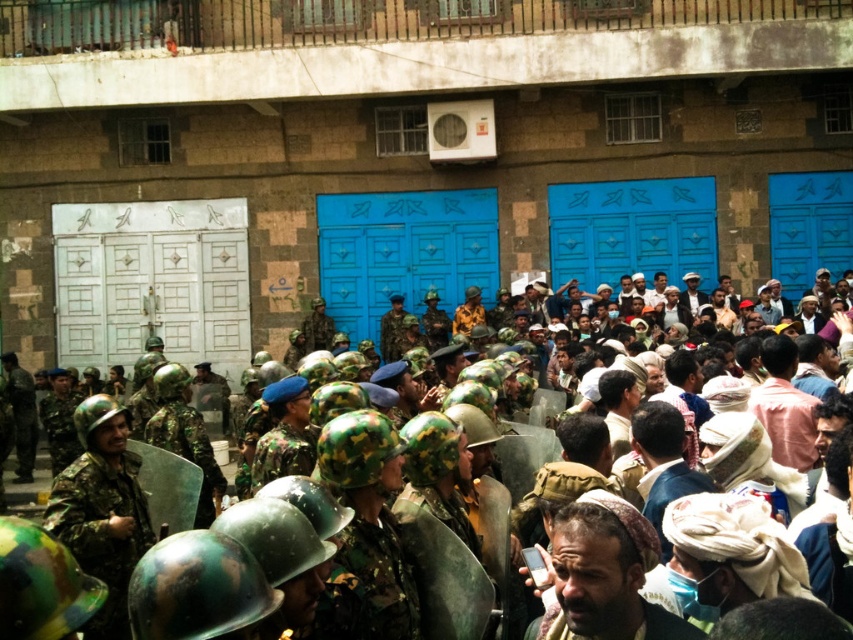
Is point (648, 632) less distant than point (397, 321)?

Yes.

Which of these two, brown leather cap at center or camouflage uniform at center, stands shorter?

brown leather cap at center

Does point (611, 548) come in front of point (399, 312)?

Yes.

You are a GUI agent. You are given a task and a screenshot of the screen. Output one action in this format:
    pyautogui.click(x=<x>, y=<y>)
    Task: Click on the brown leather cap at center
    The height and width of the screenshot is (640, 853).
    Given the screenshot: What is the action you would take?
    (606, 573)

Between camouflage helmeted crowd at center and camouflage uniform at center, which one has less height?

camouflage uniform at center

This screenshot has height=640, width=853. Find the location of `camouflage helmeted crowd at center`. camouflage helmeted crowd at center is located at coordinates (639, 380).

Is point (517, 324) farther from camera compared to point (558, 532)?

Yes.

Who is more forward, (775, 339) or (610, 499)?

Positioned in front is point (610, 499).

This screenshot has width=853, height=640. Identify the location of camouflage helmeted crowd at center. (639, 380).